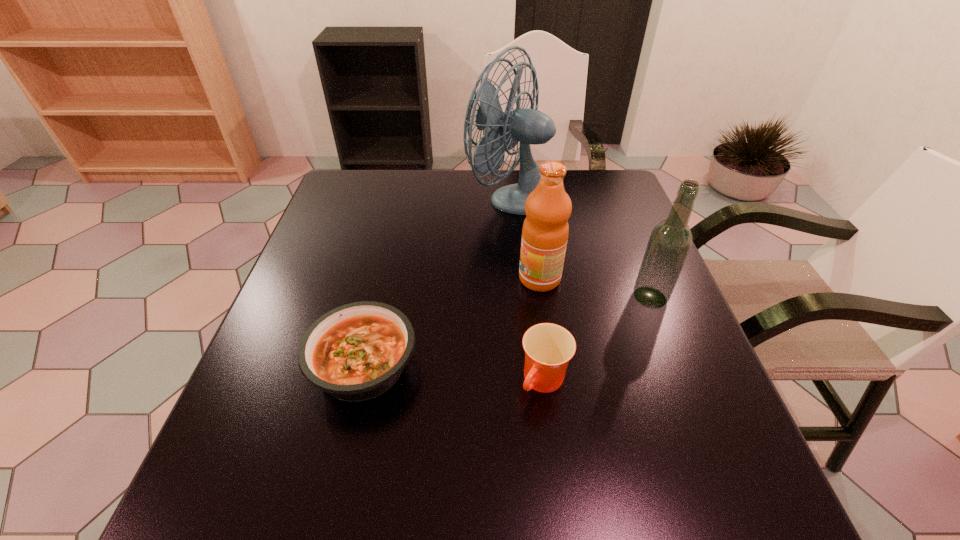
This screenshot has height=540, width=960. Find the location of `free space located 0.150m on the label side of the fruit juice`. free space located 0.150m on the label side of the fruit juice is located at coordinates (455, 279).

Identify the location of vacant space located 0.080m on the label side of the fruit juice. (485, 279).

The width and height of the screenshot is (960, 540). Find the location of `vacant space situated on the label side of the fruit juice`. vacant space situated on the label side of the fruit juice is located at coordinates (489, 279).

The width and height of the screenshot is (960, 540). What are the coordinates of `vacant area situated on the back of the rightmost object` in the screenshot? It's located at (619, 218).

The height and width of the screenshot is (540, 960). I want to click on free space located on the left of the cup, so click(x=397, y=382).

The width and height of the screenshot is (960, 540). Identify the location of vacant region located on the left of the shortest object. (269, 366).

This screenshot has width=960, height=540. I want to click on object that is at the far edge, so click(x=529, y=126).

Identify the location of object that is at the left edge. (356, 352).

You are a GUI agent. You are given a task and a screenshot of the screen. Output one action in this format:
    pyautogui.click(x=<x>, y=<y>)
    Task: Click on the object situated at the right edge
    
    Given the screenshot: What is the action you would take?
    pyautogui.click(x=670, y=241)

This screenshot has width=960, height=540. In the image, there is a desktop. In order to click on blank space at the far edge in this screenshot , I will do `click(414, 184)`.